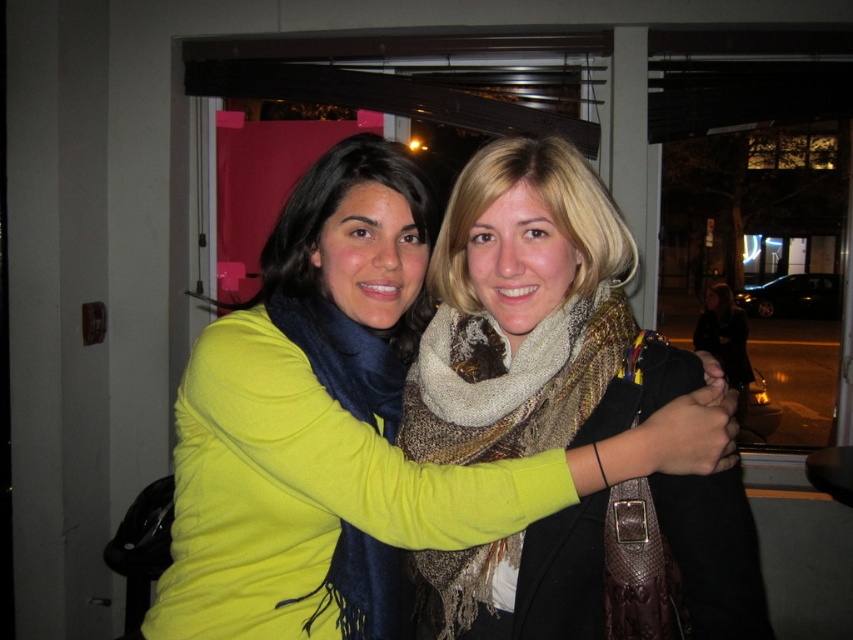
You are a photographer taking a picture of the matte yellow sweater at center and the knitted multicolored scarf at center. Since you want to focus on the sweater, which object should you adjust your camera to prioritize in the foreground?

The matte yellow sweater at center is closer to the viewer than the knitted multicolored scarf at center, so you should prioritize focusing on the matte yellow sweater at center in the foreground.

You are a fashion designer observing the image. You need to decide if the matte yellow sweater at center can be seen entirely without obstruction from the knitted multicolored scarf at center. Based on their positions, what do you think?

The matte yellow sweater at center is above the knitted multicolored scarf at center, so part of the sweater may be visible above the scarf, but the lower part of the sweater could be covered by the scarf. Therefore, the entire sweater might not be fully visible without obstruction from the scarf.

You are a fashion designer observing the scene. You need to determine which item of clothing is longer between the matte yellow sweater at center and the knitted multicolored scarf at center. Based on the description, which one is taller?

The matte yellow sweater at center is taller than the knitted multicolored scarf at center according to the description.